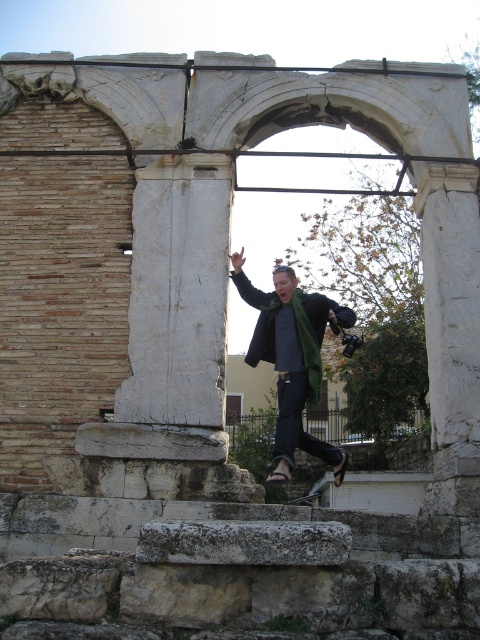
Describe the element at coordinates (178, 292) in the screenshot. The width and height of the screenshot is (480, 640). I see `white stone column at center` at that location.

At what (x,y) coordinates should I click in order to perform the action: click on white stone column at center. Please return your answer as a coordinate pair (x, y). This screenshot has width=480, height=640. Looking at the image, I should click on (178, 292).